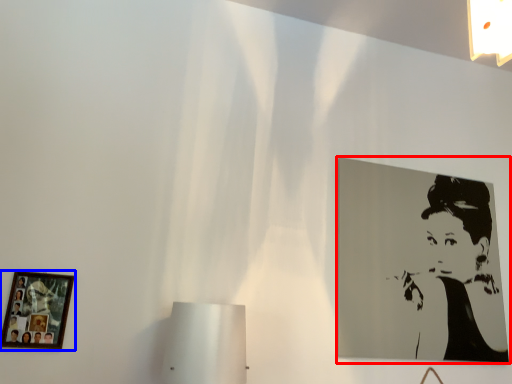
Question: Which object appears closest to the camera in this image, picture frame (highlighted by a red box) or picture frame (highlighted by a blue box)?

Choices:
 (A) picture frame
 (B) picture frame

Answer: (B)